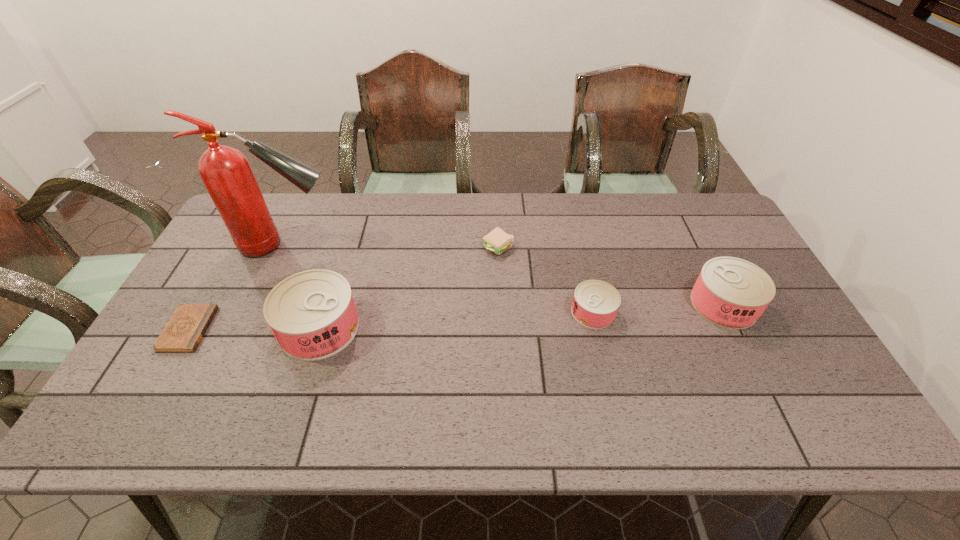
Locate an element on the screen. The width and height of the screenshot is (960, 540). free spot between the leftmost can and the fourth object from left to right is located at coordinates (409, 288).

Identify the location of unoccupied area between the fire extinguisher and the second shortest object. (392, 247).

The width and height of the screenshot is (960, 540). I want to click on empty space that is in between the second tallest can and the fire extinguisher, so click(505, 275).

I want to click on vacant area that lies between the rightmost can and the leftmost can, so click(521, 316).

Find the location of `free point between the tallest object and the diary`. free point between the tallest object and the diary is located at coordinates (237, 287).

Identify which object is located as the fifth nearest to the rightmost object. Please provide its 2D coordinates. Your answer should be formatted as a tuple, i.e. [(x, y)], where the tuple contains the x and y coordinates of a point satisfying the conditions above.

[(184, 331)]

Locate which object ranks third in proximity to the leftmost can. Please provide its 2D coordinates. Your answer should be formatted as a tuple, i.e. [(x, y)], where the tuple contains the x and y coordinates of a point satisfying the conditions above.

[(497, 241)]

Identify the location of the closest can relative to the leftmost can. The image size is (960, 540). (595, 303).

Find the location of a particular element. Image resolution: width=960 pixels, height=540 pixels. can that is the closest to the diary is located at coordinates (312, 314).

Locate an element on the screen. free region that satisfies the following two spatial constraints: 1. at the nozzle end of the fire extinguisher; 2. on the back side of the leftmost can is located at coordinates (248, 328).